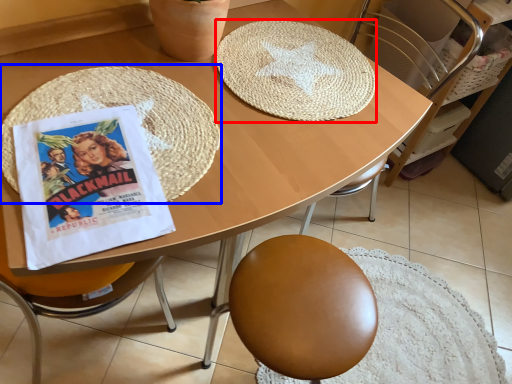
Question: Which object appears farthest to the camera in this image, mat (highlighted by a red box) or mat (highlighted by a blue box)?

Choices:
 (A) mat
 (B) mat

Answer: (A)